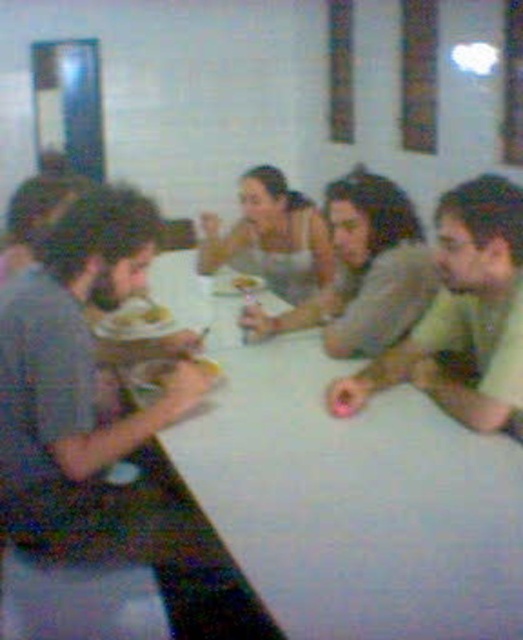
Does white glossy table at center have a larger size compared to smooth gray sweater at center?

Correct, white glossy table at center is larger in size than smooth gray sweater at center.

Does white glossy table at center have a lesser width compared to smooth gray sweater at center?

No.

In order to click on white glossy table at center in this screenshot , I will do `click(346, 490)`.

At what (x,y) coordinates should I click in order to perform the action: click on white glossy table at center. Please return your answer as a coordinate pair (x, y). Looking at the image, I should click on (346, 490).

Is green matte shirt at center positioned at the back of smooth gray sweater at center?

That is False.

Is green matte shirt at center taller than smooth gray sweater at center?

Yes.

At what (x,y) coordinates should I click in order to perform the action: click on green matte shirt at center. Please return your answer as a coordinate pair (x, y). Looking at the image, I should click on (x=462, y=316).

This screenshot has width=523, height=640. Describe the element at coordinates (346, 490) in the screenshot. I see `white glossy table at center` at that location.

What do you see at coordinates (346, 490) in the screenshot?
I see `white glossy table at center` at bounding box center [346, 490].

Locate an element on the screen. This screenshot has height=640, width=523. white glossy table at center is located at coordinates (346, 490).